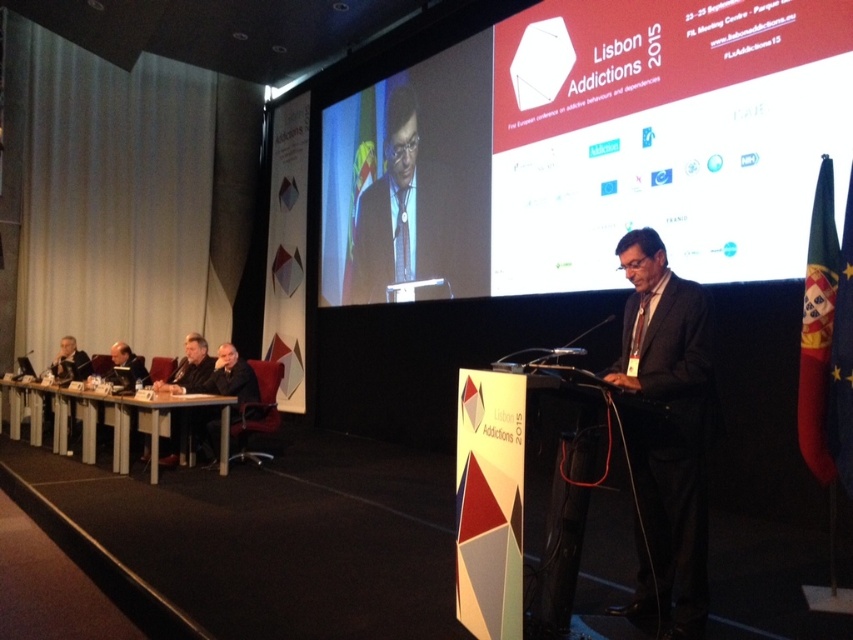
Question: Which point is closer to the camera?

Choices:
 (A) matte black suit at upper center
 (B) white plastic table at lower left

Answer: (B)

Question: Is dark suit at left thinner than matte black laptop at left?

Choices:
 (A) yes
 (B) no

Answer: (B)

Question: Which of the following is the closest to the observer?

Choices:
 (A) dark gray suit at center
 (B) white plastic table at lower left
 (C) matte black podium at center

Answer: (A)

Question: From the image, what is the correct spatial relationship of matte black podium at center in relation to matte black suit at upper center?

Choices:
 (A) left
 (B) right

Answer: (B)

Question: Does matte black suit at upper center appear on the left side of matte black laptop at left?

Choices:
 (A) no
 (B) yes

Answer: (A)

Question: Which object is positioned closest to the matte black suit at upper center?

Choices:
 (A) dark gray suit at center
 (B) dark suit at left
 (C) matte black podium at center

Answer: (C)